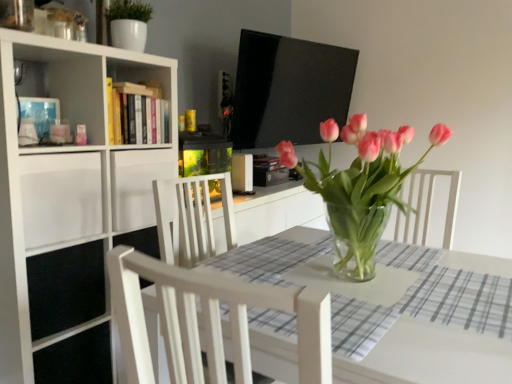
The width and height of the screenshot is (512, 384). Describe the element at coordinates (430, 357) in the screenshot. I see `clear glass table at center` at that location.

Describe the element at coordinates (128, 24) in the screenshot. I see `white glossy pot at upper left` at that location.

The width and height of the screenshot is (512, 384). Describe the element at coordinates (360, 188) in the screenshot. I see `pink glass vase at center` at that location.

Find the location of `white matte drawer at left, which is the 1th drawer in right-to-left order`. white matte drawer at left, which is the 1th drawer in right-to-left order is located at coordinates (137, 185).

In order to face white matte drawer at left, marked as the 2th drawer in a right-to-left arrangement, should I rotate leftwards or rightwards?

To align with it, rotate left about 27.249°.

Measure the distance between gray checkered tablecloth at center and camera.

35.75 inches.

Where is `hardcover book at upper center`? hardcover book at upper center is located at coordinates (137, 114).

Considering the points (135, 9) and (495, 307), which point is behind, point (135, 9) or point (495, 307)?

Point (135, 9)

From the picture: Considering the positions of objects white glossy pot at upper left and gray checkered tablecloth at center in the image provided, who is more to the left, white glossy pot at upper left or gray checkered tablecloth at center?

white glossy pot at upper left.

Considering the relative sizes of white glossy pot at upper left and gray checkered tablecloth at center in the image provided, is white glossy pot at upper left wider than gray checkered tablecloth at center?

Incorrect, the width of white glossy pot at upper left does not surpass that of gray checkered tablecloth at center.

From a real-world perspective, who is located higher, white glossy pot at upper left or gray checkered tablecloth at center?

In real-world perspective, white glossy pot at upper left is above.

From a real-world perspective, between gray checkered tablecloth at center and white matte drawer at left, which ranks as the first drawer in left-to-right order, who is vertically lower?

gray checkered tablecloth at center.

Is gray checkered tablecloth at center at the right side of white matte drawer at left, marked as the 2th drawer in a right-to-left arrangement?

Yes.

Are gray checkered tablecloth at center and white matte drawer at left, which ranks as the first drawer in left-to-right order, making contact?

No, gray checkered tablecloth at center is not with white matte drawer at left, which ranks as the first drawer in left-to-right order.

Is gray checkered tablecloth at center wider than white matte drawer at left, which ranks as the first drawer in left-to-right order?

No, gray checkered tablecloth at center is not wider than white matte drawer at left, which ranks as the first drawer in left-to-right order.

From a real-world perspective, is gray checkered tablecloth at center on white glossy pot at upper left?

No, from a real-world perspective, gray checkered tablecloth at center is not above white glossy pot at upper left.

In the scene shown: Which is closer to the camera, [441,314] or [125,30]?

Point [441,314] is positioned closer to the camera compared to point [125,30].

Which object is positioned more to the left, gray checkered tablecloth at center or white glossy pot at upper left?

From the viewer's perspective, white glossy pot at upper left appears more on the left side.

Can white glossy pot at upper left be found inside gray checkered tablecloth at center?

Actually, white glossy pot at upper left is outside gray checkered tablecloth at center.

Identify the location of plaid that is below the white matte drawer at left, which ranks as the first drawer in left-to-right order (from the image's perspective). (461, 300).

Is white matte drawer at left, marked as the 2th drawer in a right-to-left arrangement, oriented away from gray checkered tablecloth at center?

That's not correct — white matte drawer at left, marked as the 2th drawer in a right-to-left arrangement, is not looking away from gray checkered tablecloth at center.

From the picture: Can we say white matte drawer at left, marked as the 2th drawer in a right-to-left arrangement, lies outside gray checkered tablecloth at center?

white matte drawer at left, marked as the 2th drawer in a right-to-left arrangement, lies outside gray checkered tablecloth at center's area.

Who is taller, white matte drawer at left, marked as the 2th drawer in a right-to-left arrangement, or gray checkered tablecloth at center?

white matte drawer at left, marked as the 2th drawer in a right-to-left arrangement.

Image resolution: width=512 pixels, height=384 pixels. I want to click on table on the right of the white matte drawer at left, which is the 2th drawer in left-to-right order, so click(x=430, y=357).

Is clear glass table at center wider or thinner than white matte drawer at left, which is the 2th drawer in left-to-right order?

In the image, clear glass table at center appears to be wider than white matte drawer at left, which is the 2th drawer in left-to-right order.

At what (x,y) coordinates should I click in order to perform the action: click on the 2nd drawer counting from the left side of the pink glass vase at center. Please return your answer as a coordinate pair (x, y). Image resolution: width=512 pixels, height=384 pixels. Looking at the image, I should click on (60, 197).

From the picture: From the image's perspective, which is above, white matte drawer at left, marked as the 2th drawer in a right-to-left arrangement, or pink glass vase at center?

Result: white matte drawer at left, marked as the 2th drawer in a right-to-left arrangement, appears higher in the image.

Which of these two, white matte drawer at left, marked as the 2th drawer in a right-to-left arrangement, or pink glass vase at center, stands shorter?

white matte drawer at left, marked as the 2th drawer in a right-to-left arrangement.

Which of these two, white matte drawer at left, which ranks as the first drawer in left-to-right order, or pink glass vase at center, is thinner?

pink glass vase at center is thinner.

From the image's perspective, which is below, white matte bookcase at left or white matte drawer at left, which ranks as the first drawer in left-to-right order?

white matte bookcase at left appears lower in the image.

Considering the sizes of white matte bookcase at left and white matte drawer at left, marked as the 2th drawer in a right-to-left arrangement, in the image, is white matte bookcase at left taller or shorter than white matte drawer at left, marked as the 2th drawer in a right-to-left arrangement,?

In the image, white matte bookcase at left appears to be taller than white matte drawer at left, marked as the 2th drawer in a right-to-left arrangement.

Is white matte bookcase at left in front of white matte drawer at left, marked as the 2th drawer in a right-to-left arrangement?

Yes.

Does point (13, 295) appear closer or farther from the camera than point (81, 161)?

Clearly, point (13, 295) is closer to the camera than point (81, 161).

Image resolution: width=512 pixels, height=384 pixels. Find the location of `plaid lying in front of the white glossy pot at upper left`. plaid lying in front of the white glossy pot at upper left is located at coordinates (461, 300).

This screenshot has height=384, width=512. What are the coordinates of `drawer that is the 1st one when counting upward from the gray checkered tablecloth at center (from the image's perspective)` in the screenshot? It's located at (60, 197).

Based on their spatial positions, is white matte drawer at left, which ranks as the first drawer in left-to-right order, or white matte drawer at left, which is the 1th drawer in right-to-left order, closer to clear glass table at center?

white matte drawer at left, which ranks as the first drawer in left-to-right order, lies closer to clear glass table at center than the other object.

Considering their positions, is white matte bookcase at left positioned closer to white glossy pot at upper left than pink glass vase at center?

The object closer to white glossy pot at upper left is white matte bookcase at left.

Which object lies further to the anchor point pink glass vase at center, clear glass table at center or gray checkered tablecloth at center?

clear glass table at center is further to pink glass vase at center.

Looking at the image, which one is located closer to white matte drawer at left, which ranks as the first drawer in left-to-right order, white matte bookcase at left or white glossy pot at upper left?

Among the two, white matte bookcase at left is located nearer to white matte drawer at left, which ranks as the first drawer in left-to-right order.

From the image, which object appears to be nearer to white matte drawer at left, marked as the 2th drawer in a right-to-left arrangement, clear glass table at center or gray checkered tablecloth at center?

Among the two, clear glass table at center is located nearer to white matte drawer at left, marked as the 2th drawer in a right-to-left arrangement.

From the image, which object appears to be farther from white matte drawer at left, marked as the 2th drawer in a right-to-left arrangement, clear glass table at center or pink glass vase at center?

pink glass vase at center is positioned further to the anchor white matte drawer at left, marked as the 2th drawer in a right-to-left arrangement.

From the image, which object appears to be nearer to gray checkered tablecloth at center, clear glass table at center or hardcover book at upper center?

clear glass table at center is closer to gray checkered tablecloth at center.

Considering their positions, is hardcover book at upper center positioned further to clear glass table at center than white matte bookcase at left?

Among the two, hardcover book at upper center is located further to clear glass table at center.

The width and height of the screenshot is (512, 384). Identify the location of plaid between clear glass table at center and hardcover book at upper center in the front-back direction. (461, 300).

Locate an element on the screen. This screenshot has width=512, height=384. drawer between white matte drawer at left, marked as the 2th drawer in a right-to-left arrangement, and gray checkered tablecloth at center from left to right is located at coordinates (137, 185).

Locate an element on the screen. The width and height of the screenshot is (512, 384). drawer between white matte bookcase at left and white matte drawer at left, which is the 2th drawer in left-to-right order, along the z-axis is located at coordinates (60, 197).

Where is `houseplant located between white matte bookcase at left and clear glass table at center in the left-right direction`? The width and height of the screenshot is (512, 384). houseplant located between white matte bookcase at left and clear glass table at center in the left-right direction is located at coordinates (360, 188).